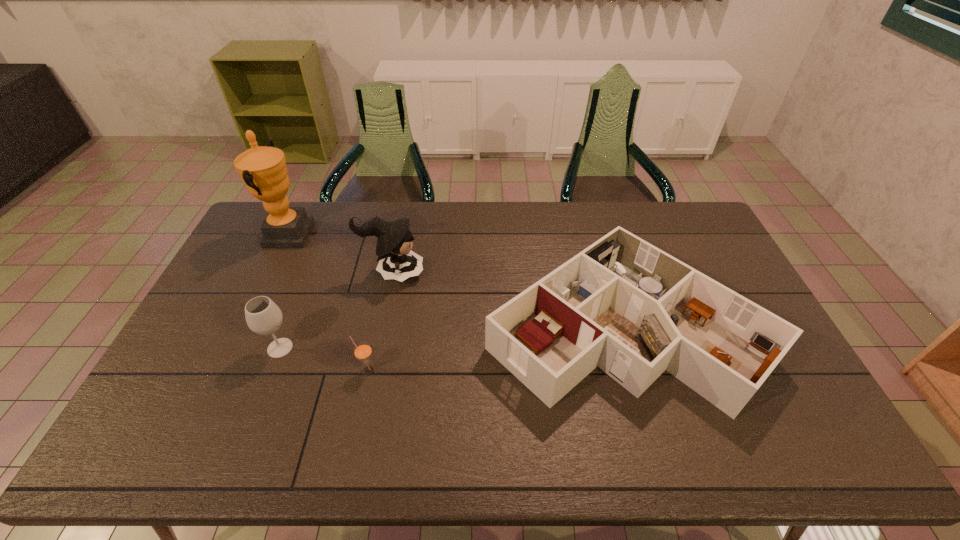
Locate an element on the screen. free space located 0.070m on the front of the rightmost object is located at coordinates (657, 447).

Where is `free space located 0.220m on the right of the straw`? The image size is (960, 540). free space located 0.220m on the right of the straw is located at coordinates (456, 370).

Where is `object located at the far edge`? The width and height of the screenshot is (960, 540). object located at the far edge is located at coordinates click(x=263, y=169).

Identify the location of object positioned at the left edge. (263, 169).

What are the coordinates of `object that is at the right edge` in the screenshot? It's located at (622, 304).

Where is `object positioned at the far left corner`? The height and width of the screenshot is (540, 960). object positioned at the far left corner is located at coordinates (263, 169).

I want to click on vacant position at the far edge of the desktop, so click(340, 228).

Image resolution: width=960 pixels, height=540 pixels. What are the coordinates of `free space at the near edge` in the screenshot? It's located at (758, 440).

In order to click on vacant space at the left edge in this screenshot , I will do `click(217, 320)`.

The height and width of the screenshot is (540, 960). In order to click on free space at the right edge of the desktop in this screenshot , I will do `click(776, 377)`.